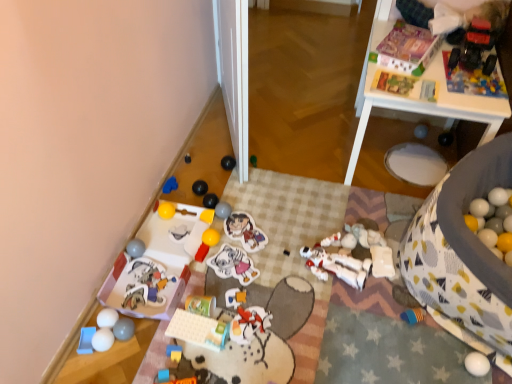
The image size is (512, 384). In order to click on vacant area that is situated to the right of white matte sticker at center, which is the nineteenth toy from left to right in this screenshot , I will do `click(280, 272)`.